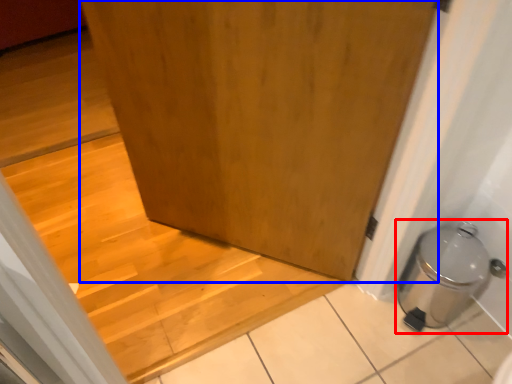
Question: Which point is further to the camera, water heater (highlighted by a red box) or door (highlighted by a blue box)?

Choices:
 (A) water heater
 (B) door

Answer: (A)